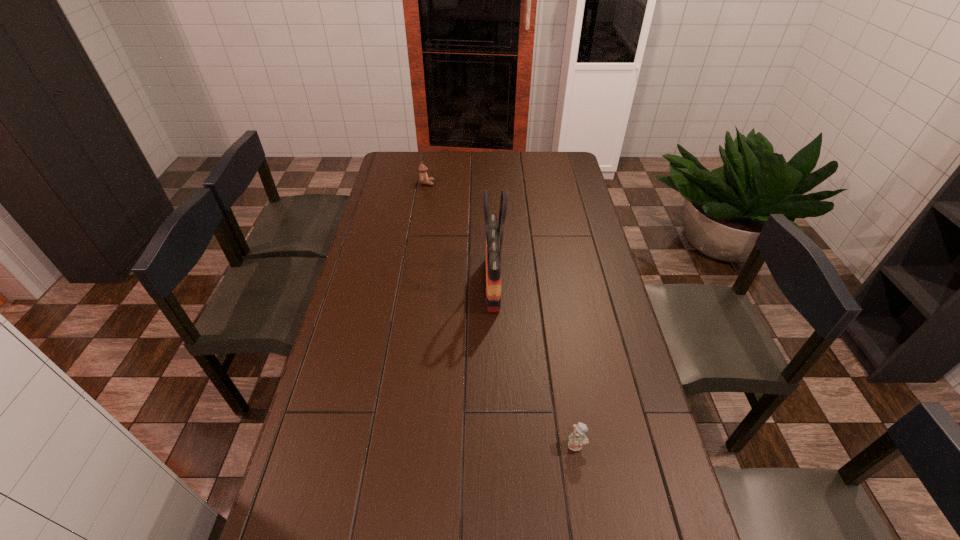
Locate an element on the screen. This screenshot has width=960, height=540. the tallest object is located at coordinates (493, 252).

Identify the location of the second farthest object. The image size is (960, 540). (493, 252).

Identify the location of the leftmost object. This screenshot has width=960, height=540. (423, 177).

This screenshot has width=960, height=540. In order to click on the farthest object in this screenshot , I will do `click(423, 177)`.

Locate an element on the screen. Image resolution: width=960 pixels, height=540 pixels. the rightmost object is located at coordinates (577, 438).

Locate an element on the screen. Image resolution: width=960 pixels, height=540 pixels. the shorter teddy bear is located at coordinates (577, 438).

Find the location of a particular element. This screenshot has height=540, width=960. vacant space located 0.220m on the front-facing side of the second object from right to left is located at coordinates (420, 284).

Identify the location of free region located 0.240m on the front-facing side of the second object from right to left. The width and height of the screenshot is (960, 540). (415, 284).

What are the coordinates of `vacant position located 0.220m on the front-facing side of the second object from right to left` in the screenshot? It's located at [420, 284].

The height and width of the screenshot is (540, 960). Identify the location of free space located 0.050m on the front-facing side of the farther teddy bear. tap(444, 183).